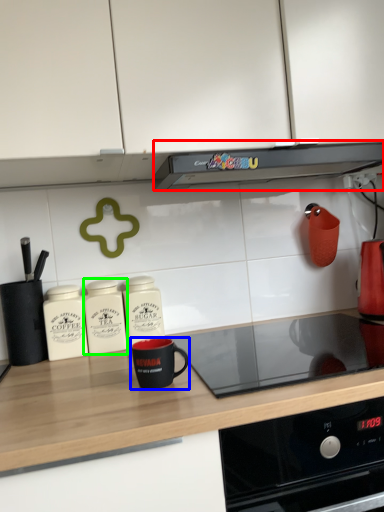
Question: Estimate the real-world distances between objects in this image. Which object is closer to kitchen appliance (highlighted by a red box), kitchen appliance (highlighted by a blue box) or kitchen appliance (highlighted by a green box)?

Choices:
 (A) kitchen appliance
 (B) kitchen appliance

Answer: (B)